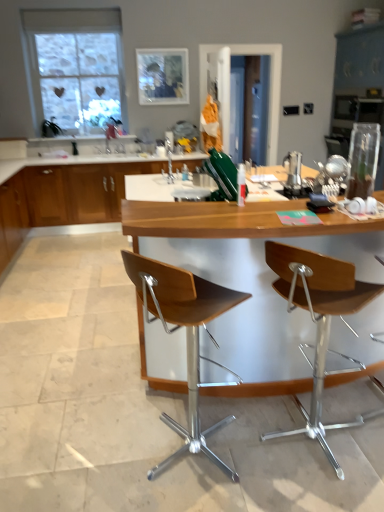
Question: Looking at the image, does wooden cabinet at center seem bigger or smaller compared to wooden seat at right, the 2th chair from the left?

Choices:
 (A) small
 (B) big

Answer: (B)

Question: From the image's perspective, is wooden cabinet at center above or below wooden seat at right, the 1th chair in the right-to-left sequence?

Choices:
 (A) above
 (B) below

Answer: (A)

Question: Which object is the closest to the wooden seat at right, the 2th chair from the left?

Choices:
 (A) wooden seat at center, the first chair viewed from the left
 (B) woodenmaterial/texturetable at center
 (C) clear glass window at upper left
 (D) wooden cabinet at center

Answer: (B)

Question: Which object is the farthest from the wooden seat at right, the 1th chair in the right-to-left sequence?

Choices:
 (A) wooden cabinet at center
 (B) clear glass window at upper left
 (C) wooden seat at center, arranged as the second chair when viewed from the right
 (D) woodenmaterial/texturetable at center

Answer: (B)